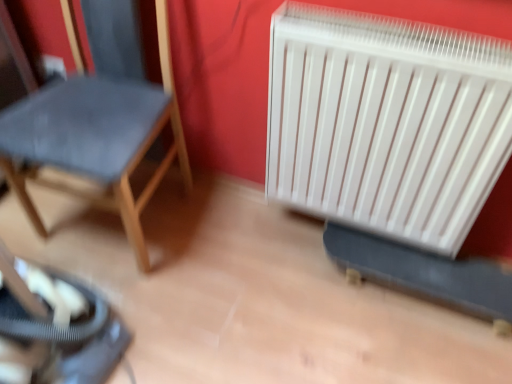
Find the location of a particular element. Image resolution: width=512 pixels, height=384 pixels. velvet blue chair at left is located at coordinates (96, 134).

This screenshot has height=384, width=512. What do you see at coordinates (96, 134) in the screenshot?
I see `velvet blue chair at left` at bounding box center [96, 134].

What is the approximate height of white plastic radiator at right?

It is 61.05 centimeters.

Locate an element on the screen. white plastic radiator at right is located at coordinates (386, 122).

The width and height of the screenshot is (512, 384). Describe the element at coordinates (386, 122) in the screenshot. I see `white plastic radiator at right` at that location.

Locate an element on the screen. This screenshot has height=384, width=512. velvet blue chair at left is located at coordinates (96, 134).

Does velvet blue chair at left appear on the left side of white plastic radiator at right?

Indeed, velvet blue chair at left is positioned on the left side of white plastic radiator at right.

Considering their positions, is velvet blue chair at left located in front of or behind white plastic radiator at right?

Visually, velvet blue chair at left is located in front of white plastic radiator at right.

Does point (20, 146) appear closer or farther from the camera than point (465, 165)?

Clearly, point (20, 146) is more distant from the camera than point (465, 165).

From the image's perspective, which is below, velvet blue chair at left or white plastic radiator at right?

white plastic radiator at right appears lower in the image.

Looking at this image, from a real-world perspective, is velvet blue chair at left positioned above or below white plastic radiator at right?

In terms of real-world spatial position, velvet blue chair at left is above white plastic radiator at right.

Is velvet blue chair at left wider than white plastic radiator at right?

Correct, the width of velvet blue chair at left exceeds that of white plastic radiator at right.

Between velvet blue chair at left and white plastic radiator at right, which one has more height?

Standing taller between the two is velvet blue chair at left.

Considering the sizes of objects velvet blue chair at left and white plastic radiator at right in the image provided, who is smaller, velvet blue chair at left or white plastic radiator at right?

white plastic radiator at right is smaller.

Is velvet blue chair at left spatially inside white plastic radiator at right, or outside of it?

velvet blue chair at left is outside white plastic radiator at right.

Is velvet blue chair at left not near white plastic radiator at right?

No, there isn't a large distance between velvet blue chair at left and white plastic radiator at right.

Is velvet blue chair at left oriented towards white plastic radiator at right?

No, velvet blue chair at left is not turned towards white plastic radiator at right.

What's the angular difference between velvet blue chair at left and white plastic radiator at right's facing directions?

The facing directions of velvet blue chair at left and white plastic radiator at right are 3.63 degrees apart.

Locate an element on the screen. This screenshot has height=384, width=512. radiator below the velvet blue chair at left (from a real-world perspective) is located at coordinates (386, 122).

Would you say white plastic radiator at right is to the left or to the right of velvet blue chair at left in the picture?

From the image, it's evident that white plastic radiator at right is to the right of velvet blue chair at left.

Which object is more forward, white plastic radiator at right or velvet blue chair at left?

velvet blue chair at left is more forward.

Is point (311, 119) positioned behind point (100, 127)?

Yes, it is.

From the image's perspective, is white plastic radiator at right located beneath velvet blue chair at left?

Correct, white plastic radiator at right appears lower than velvet blue chair at left in the image.

Looking at this image, from a real-world perspective, is white plastic radiator at right positioned above or below velvet blue chair at left?

white plastic radiator at right is situated lower than velvet blue chair at left in the real world.

Between white plastic radiator at right and velvet blue chair at left, which one has smaller width?

white plastic radiator at right.

Does white plastic radiator at right have a lesser height compared to velvet blue chair at left?

Yes, white plastic radiator at right is shorter than velvet blue chair at left.

In terms of size, does white plastic radiator at right appear bigger or smaller than velvet blue chair at left?

Clearly, white plastic radiator at right is smaller in size than velvet blue chair at left.

In the scene shown: Which is correct: white plastic radiator at right is inside velvet blue chair at left, or outside of it?

white plastic radiator at right lies outside velvet blue chair at left.

In the scene shown: Is white plastic radiator at right far from velvet blue chair at left?

No, white plastic radiator at right is in close proximity to velvet blue chair at left.

From the picture: Is white plastic radiator at right turned away from velvet blue chair at left?

No, white plastic radiator at right is not facing the opposite direction of velvet blue chair at left.

What's the angular difference between white plastic radiator at right and velvet blue chair at left's facing directions?

The angular difference between white plastic radiator at right and velvet blue chair at left is 3.63 degrees.

Measure the distance from white plastic radiator at right to velvet blue chair at left.

white plastic radiator at right is 22.72 inches from velvet blue chair at left.

The height and width of the screenshot is (384, 512). What are the coordinates of `chair above the white plastic radiator at right (from the image's perspective)` in the screenshot? It's located at coord(96,134).

Where is `radiator on the right of velvet blue chair at left`? radiator on the right of velvet blue chair at left is located at coordinates (386, 122).

Locate an element on the screen. The height and width of the screenshot is (384, 512). radiator below the velvet blue chair at left (from the image's perspective) is located at coordinates (386, 122).